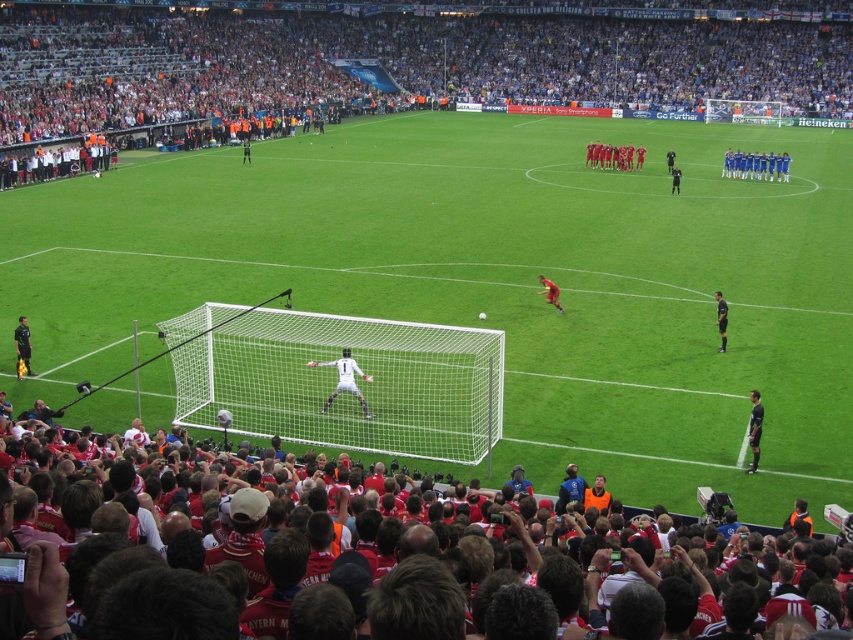
Question: Among these points, which one is nearest to the camera?

Choices:
 (A) (24, 317)
 (B) (633, 164)
 (C) (561, 180)
 (D) (544, 282)

Answer: (A)

Question: Considering the relative positions of white net at center and yellow-orange jersey at center in the image provided, where is white net at center located with respect to yellow-orange jersey at center?

Choices:
 (A) below
 (B) above

Answer: (A)

Question: Can you confirm if blue jersey at center is bigger than black uniformed person at center?

Choices:
 (A) yes
 (B) no

Answer: (A)

Question: Which object is positioned farthest from the black uniform at center?

Choices:
 (A) black uniformed person at center
 (B) green grass football field at center
 (C) white net at center
 (D) white matte goalie at center

Answer: (C)

Question: Is green grass football field at center to the right of black uniform at center from the viewer's perspective?

Choices:
 (A) no
 (B) yes

Answer: (A)

Question: Estimate the real-world distances between objects in this image. Which object is closer to the black leather jacket at right?

Choices:
 (A) blue jersey at center
 (B) black uniformed person at center
 (C) white net at center

Answer: (B)